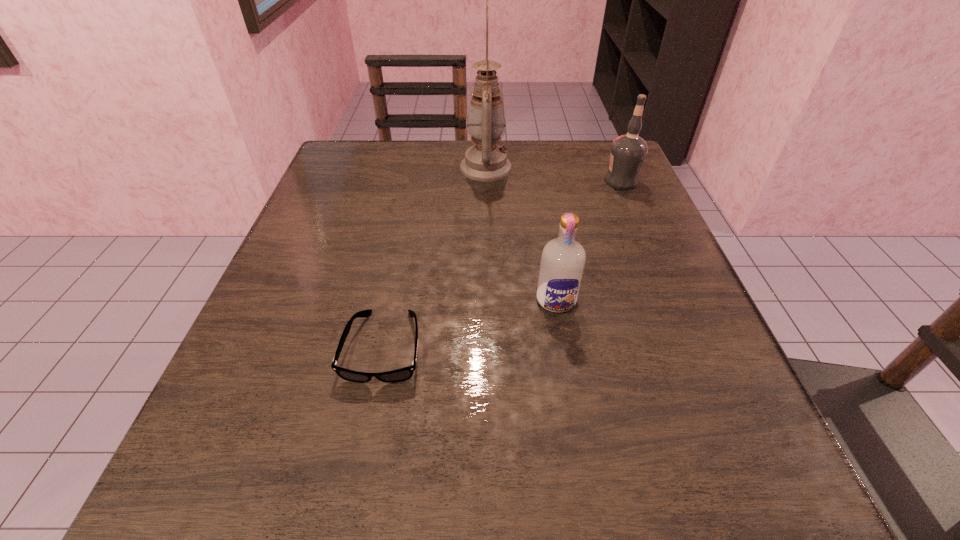
Image resolution: width=960 pixels, height=540 pixels. Identify the location of the third object from right to left. (485, 161).

Where is `oil lamp`? This screenshot has height=540, width=960. oil lamp is located at coordinates (485, 161).

At what (x,y) coordinates should I click in order to perform the action: click on the farther vodka. Please return your answer as a coordinate pair (x, y). This screenshot has height=540, width=960. Looking at the image, I should click on (628, 152).

Locate an element on the screen. This screenshot has width=960, height=540. the right vodka is located at coordinates (628, 152).

You are a GUI agent. You are given a task and a screenshot of the screen. Output one action in this format:
    pyautogui.click(x=<x>, y=<y>)
    Task: Click on the shorter vodka
    Image resolution: width=960 pixels, height=540 pixels.
    Given the screenshot: What is the action you would take?
    pyautogui.click(x=562, y=263)

Identify the location of the left vodka. (562, 263).

Where is `sunglasses`? Image resolution: width=960 pixels, height=540 pixels. sunglasses is located at coordinates (402, 374).

At what (x,y) coordinates should I click in order to perform the action: click on the shortest object. Please return your answer as a coordinate pair (x, y). Looking at the image, I should click on (402, 374).

Image resolution: width=960 pixels, height=540 pixels. Identify the location of free spot located 0.110m on the left of the tallest object. (413, 168).

The image size is (960, 540). Identify the location of vacant space located 0.200m on the front label of the farther vodka. (515, 181).